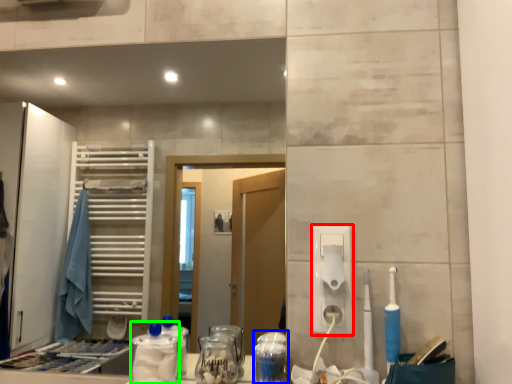
Question: Considering the real-world distances, which object is closest to hand dryer (highlighted by a red box)? glass jar (highlighted by a blue box) or bottle (highlighted by a green box).

Choices:
 (A) glass jar
 (B) bottle

Answer: (A)